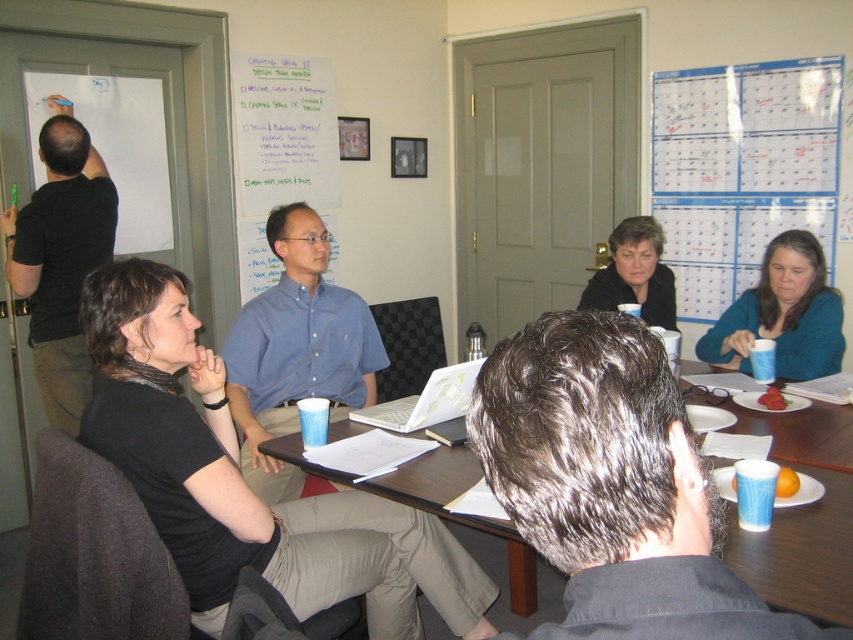
Question: Does teal fabric sweater at right appear on the left side of white plastic laptop at center?

Choices:
 (A) no
 (B) yes

Answer: (A)

Question: Which point is closer to the camera?

Choices:
 (A) black shirt at left
 (B) blue shirt at center
 (C) white paper calendar at upper right
 (D) blue paper cup at lower center

Answer: (D)

Question: Is blue shirt at center wider than white plastic laptop at center?

Choices:
 (A) yes
 (B) no

Answer: (A)

Question: Which object is positioned closest to the white paper calendar at upper right?

Choices:
 (A) white plastic laptop at center
 (B) blue paper cup at lower center
 (C) teal fabric sweater at right
 (D) black shirt at left

Answer: (C)

Question: Considering the real-world distances, which object is farthest from the black shirt at left?

Choices:
 (A) blue shirt at center
 (B) blue paper cup at lower center

Answer: (B)

Question: Is white paper calendar at upper right smaller than blue shirt at center?

Choices:
 (A) yes
 (B) no

Answer: (B)